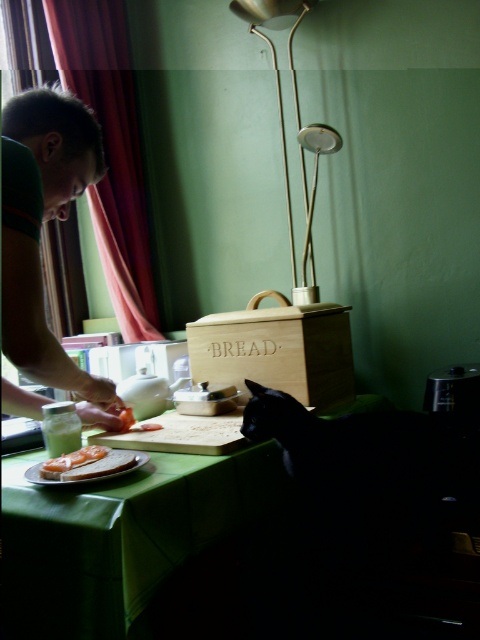
Between point (153, 508) and point (24, 248), which one is positioned in front?

Point (24, 248) is more forward.

Between point (108, 572) and point (33, 140), which one is positioned behind?

Point (33, 140)

Which is in front, point (228, 512) or point (4, 300)?

Point (4, 300) is in front.

Locate an element on the screen. green fabric table at lower center is located at coordinates (120, 536).

How much distance is there between green fabric table at lower center and slightly toasted bread at center?

A distance of 5.31 inches exists between green fabric table at lower center and slightly toasted bread at center.

Is green fabric table at lower center to the left of slightly toasted bread at center from the viewer's perspective?

No, green fabric table at lower center is not to the left of slightly toasted bread at center.

Image resolution: width=480 pixels, height=640 pixels. Identify the location of green fabric table at lower center. (120, 536).

Image resolution: width=480 pixels, height=640 pixels. I want to click on green fabric table at lower center, so pos(120,536).

Which of these two, green fabric table at lower center or gold metallic lamp at upper center, stands taller?

Standing taller between the two is gold metallic lamp at upper center.

Measure the distance from green fabric table at lower center to gold metallic lamp at upper center.

They are 35.58 inches apart.

Does point (70, 570) lie in front of point (292, 260)?

Yes.

You are a GUI agent. You are given a task and a screenshot of the screen. Output one action in this format:
    pyautogui.click(x=<x>, y=<y>)
    Task: Click on the green fabric table at lower center
    This screenshot has width=480, height=640.
    Given the screenshot: What is the action you would take?
    pyautogui.click(x=120, y=536)